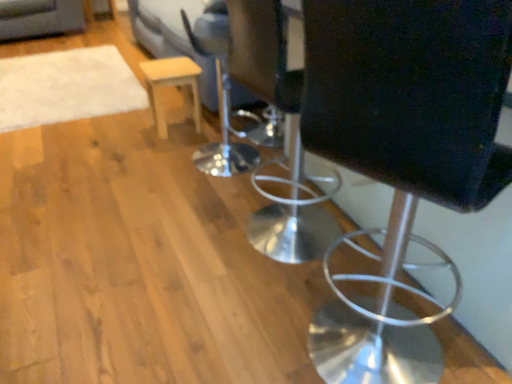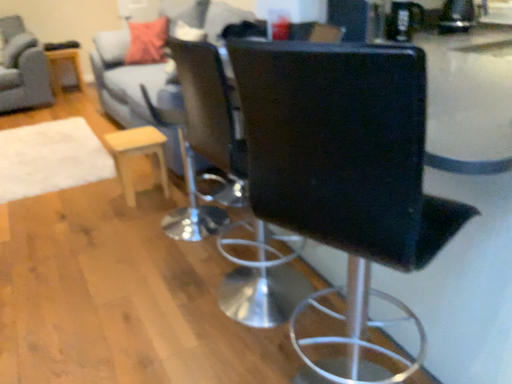
Question: Which way did the camera rotate in the video?

Choices:
 (A) rotated upward
 (B) rotated downward

Answer: (A)